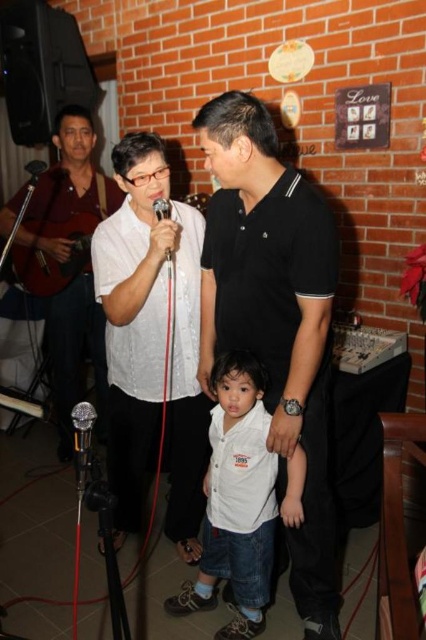
You are standing at the origin point in the image. A person is wearing a matte black shirt at center. Where is the person located in terms of coordinates?

The person wearing the matte black shirt at center is located at coordinates point (69, 186).